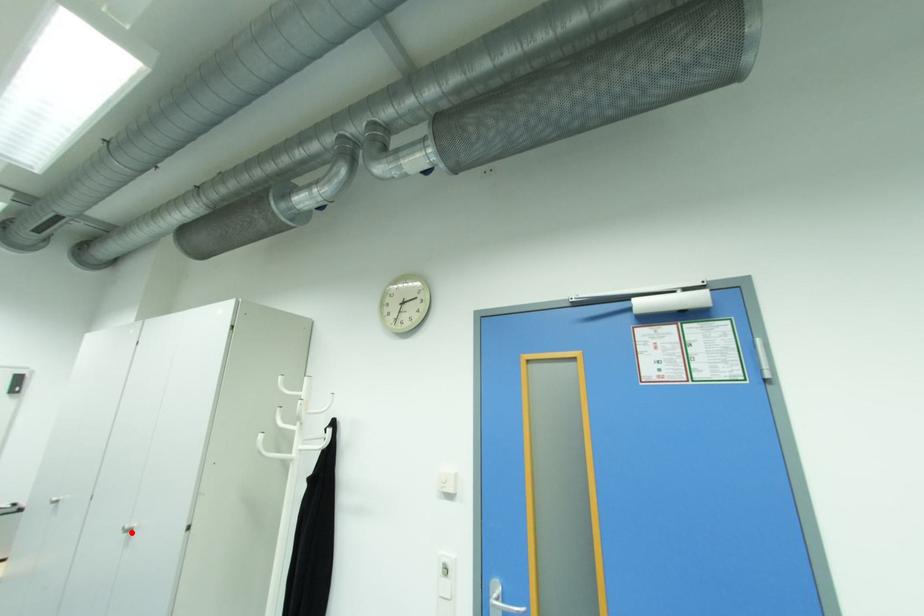
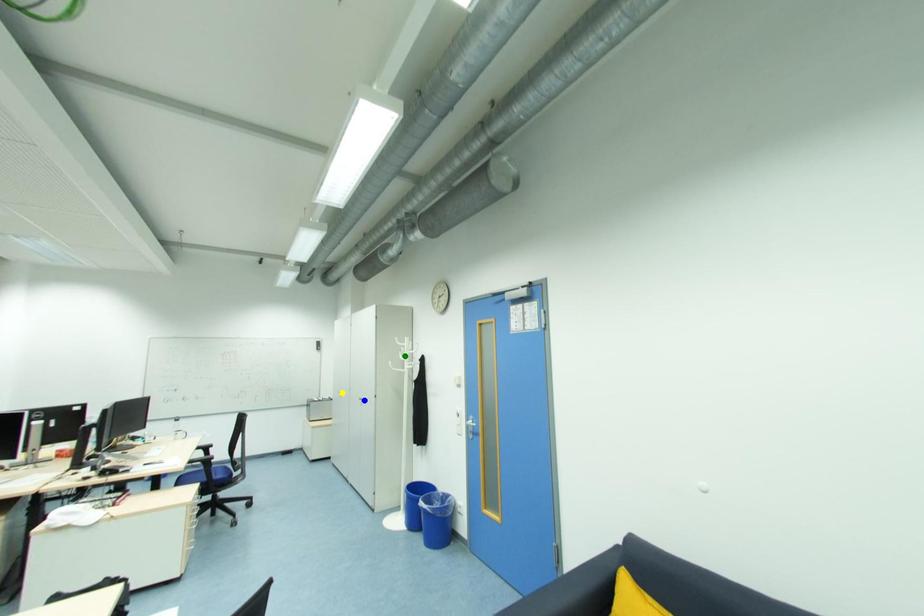
Question: I am providing you with two images of the same scene from different viewpoints. A red point is marked on the first image. You are given multiple points on the second image. Which spot in image 2 lines up with the point in image 1?

Choices:
 (A) yellow point
 (B) blue point
 (C) green point

Answer: (B)